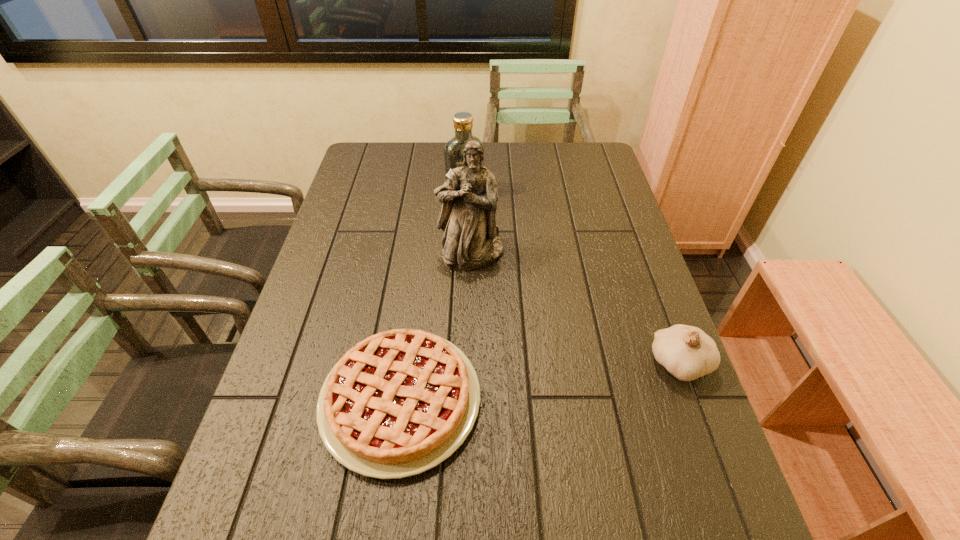
Identify the location of free point at the near edge. (610, 461).

In the image, there is a desktop. At what (x,y) coordinates should I click in order to perform the action: click on vacant space at the left edge. Please return your answer as a coordinate pair (x, y). Image resolution: width=960 pixels, height=540 pixels. Looking at the image, I should click on (346, 212).

You are a GUI agent. You are given a task and a screenshot of the screen. Output one action in this format:
    pyautogui.click(x=<x>, y=<y>)
    Task: Click on the free space at the right edge of the desktop
    The height and width of the screenshot is (540, 960).
    Given the screenshot: What is the action you would take?
    pyautogui.click(x=607, y=274)

In the image, there is a desktop. Identify the location of free space at the far left corner. (354, 176).

Where is `vacant position at the near left corner of the desktop`? The image size is (960, 540). vacant position at the near left corner of the desktop is located at coordinates (282, 479).

Identify the location of vacant space at the far right corner. The height and width of the screenshot is (540, 960). (567, 175).

You are a GUI agent. You are given a task and a screenshot of the screen. Output one action in this format:
    pyautogui.click(x=<x>, y=<y>)
    Task: Click on the vacant area at the near right corner of the desktop
    The image size is (960, 540).
    Given the screenshot: What is the action you would take?
    pyautogui.click(x=713, y=489)

Find the location of a particular element. The height and width of the screenshot is (540, 960). free space that is in between the shortest object and the tallest object is located at coordinates point(436,327).

Where is `unoccupied position between the vodka and the pie`? unoccupied position between the vodka and the pie is located at coordinates (433, 297).

Locate an element on the screen. vacant area between the tallest object and the shortest object is located at coordinates (436, 327).